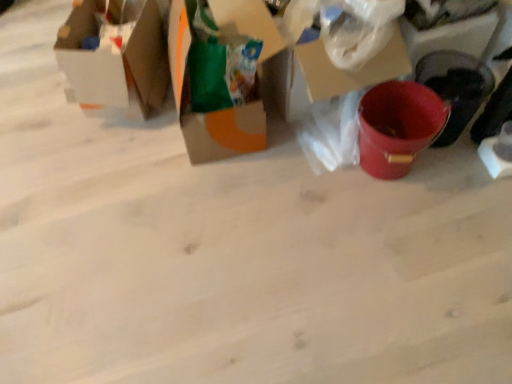
Find the location of `empty space that is to the right of cardboard box at center, the 2th box viewed from the left`. empty space that is to the right of cardboard box at center, the 2th box viewed from the left is located at coordinates click(285, 144).